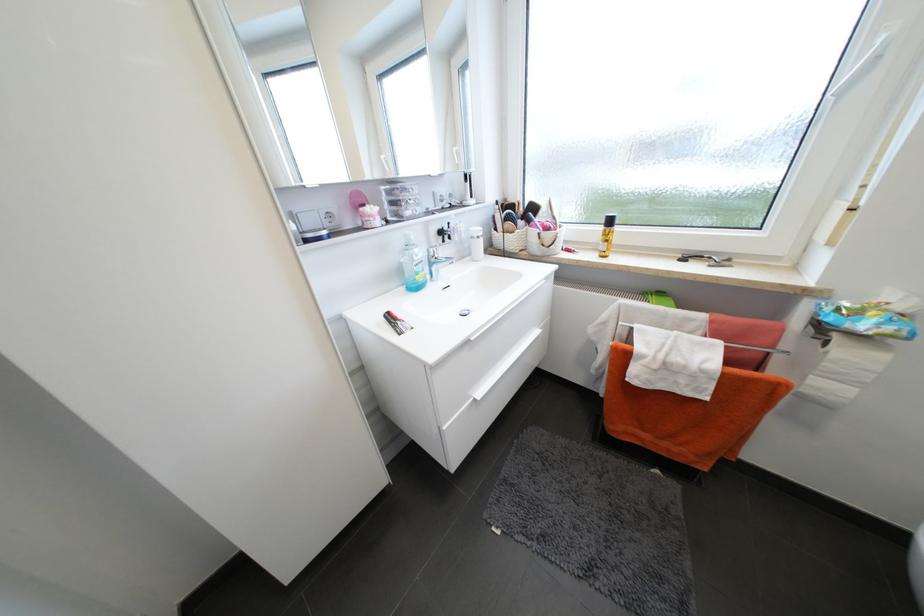
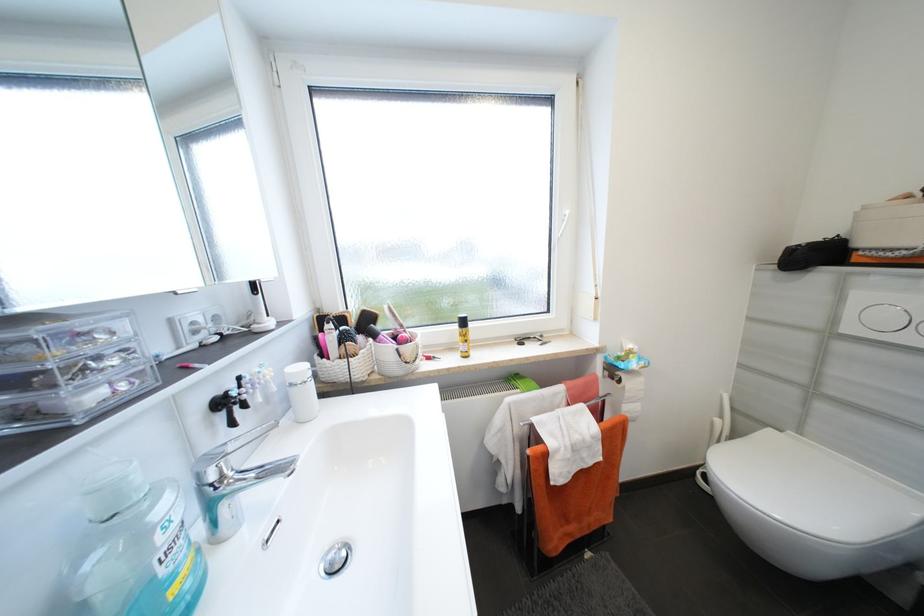
Question: The camera is either moving clockwise (left) or counter-clockwise (right) around the object. The first image is from the beginning of the video and the second image is from the end. Is the camera moving left or right when shooting the video?

Choices:
 (A) Left
 (B) Right

Answer: (A)